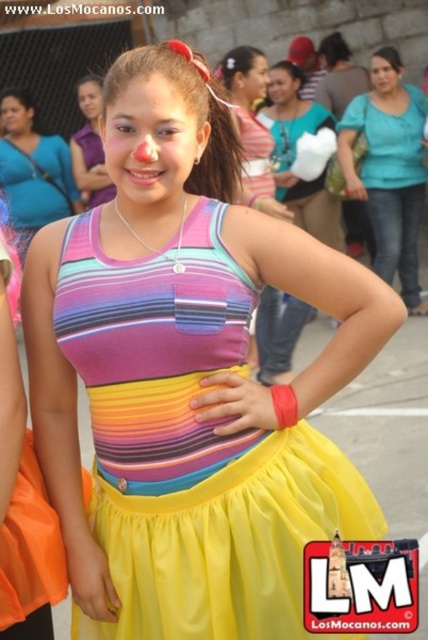
Between matte clown nose at center and smooth skin face at center, which one has less height?

smooth skin face at center

You are a GUI agent. You are given a task and a screenshot of the screen. Output one action in this format:
    pyautogui.click(x=<x>, y=<y>)
    Task: Click on the matte clown nose at center
    The width and height of the screenshot is (428, 640).
    Given the screenshot: What is the action you would take?
    [253, 81]

Who is positioned more to the right, matte skin face at center or matte clown nose at center?

matte clown nose at center

In the scene shown: Does matte skin face at center have a smaller size compared to matte clown nose at center?

Yes, matte skin face at center is smaller than matte clown nose at center.

Who is more forward, (146, 122) or (243, 77)?

Point (146, 122) is in front.

Identify the location of matte skin face at center. (151, 141).

Who is higher up, multicolored fabric dress at center or matte black face at center?

Positioned higher is matte black face at center.

Who is shorter, multicolored fabric dress at center or matte black face at center?

matte black face at center is shorter.

Describe the element at coordinates (192, 445) in the screenshot. I see `multicolored fabric dress at center` at that location.

Image resolution: width=428 pixels, height=640 pixels. Identify the location of multicolored fabric dress at center. (192, 445).